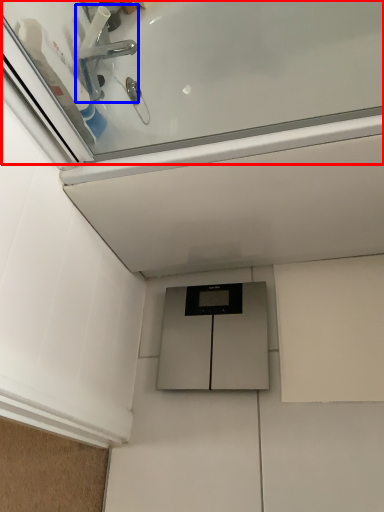
Question: Which point is closer to the camera, bath (highlighted by a red box) or tap (highlighted by a blue box)?

Choices:
 (A) bath
 (B) tap

Answer: (A)